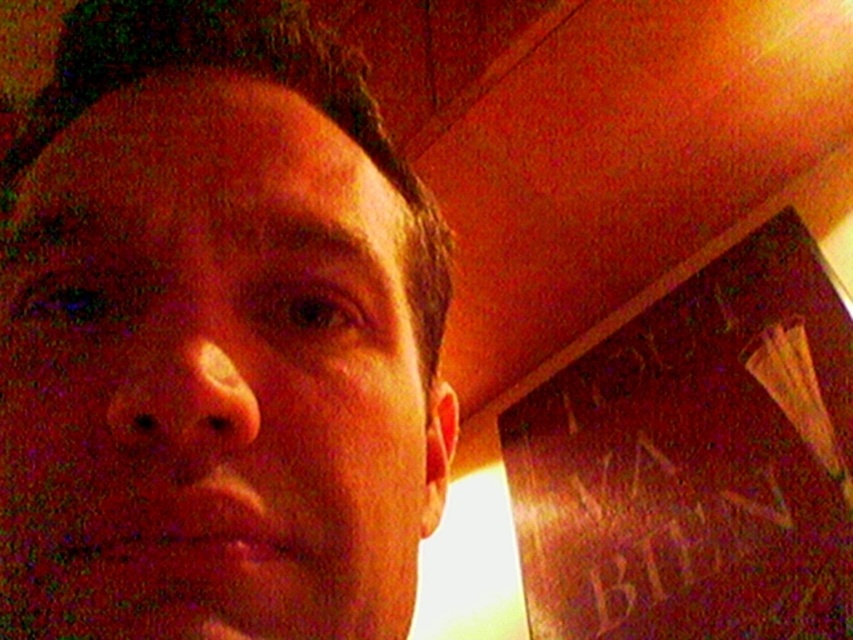
Can you confirm if matte skin at center is smaller than wooden bulletin board at right?

Yes, matte skin at center is smaller than wooden bulletin board at right.

Does matte skin at center appear on the left side of wooden bulletin board at right?

Correct, you'll find matte skin at center to the left of wooden bulletin board at right.

Who is more forward, [413,291] or [607,460]?

Point [413,291]

What are the coordinates of `matte skin at center` in the screenshot? It's located at (213, 337).